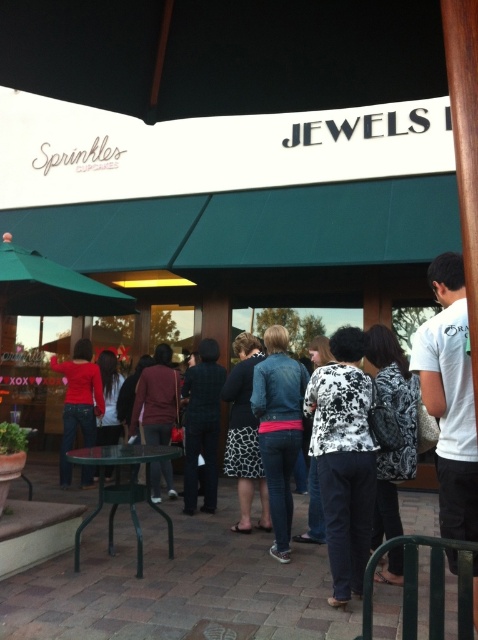
Is patterned fabric backpack at center wider than green metal table at lower left?

No, patterned fabric backpack at center is not wider than green metal table at lower left.

Can you confirm if patterned fabric backpack at center is positioned to the right of green metal table at lower left?

Yes, patterned fabric backpack at center is to the right of green metal table at lower left.

Identify the location of patterned fabric backpack at center. This screenshot has width=478, height=640. (399, 426).

Who is lower down, denim jacket at center or printed fabric skirt at center?

printed fabric skirt at center is lower down.

Describe the element at coordinates (279, 429) in the screenshot. I see `denim jacket at center` at that location.

You are a GUI agent. You are given a task and a screenshot of the screen. Output one action in this format:
    pyautogui.click(x=<x>, y=<y>)
    Task: Click on the denim jacket at center
    
    Given the screenshot: What is the action you would take?
    pyautogui.click(x=279, y=429)

Which is above, patterned fabric backpack at center or maroon sweater at center?

Positioned higher is patterned fabric backpack at center.

Who is shorter, patterned fabric backpack at center or maroon sweater at center?

patterned fabric backpack at center

Identify the location of patterned fabric backpack at center. The width and height of the screenshot is (478, 640). (399, 426).